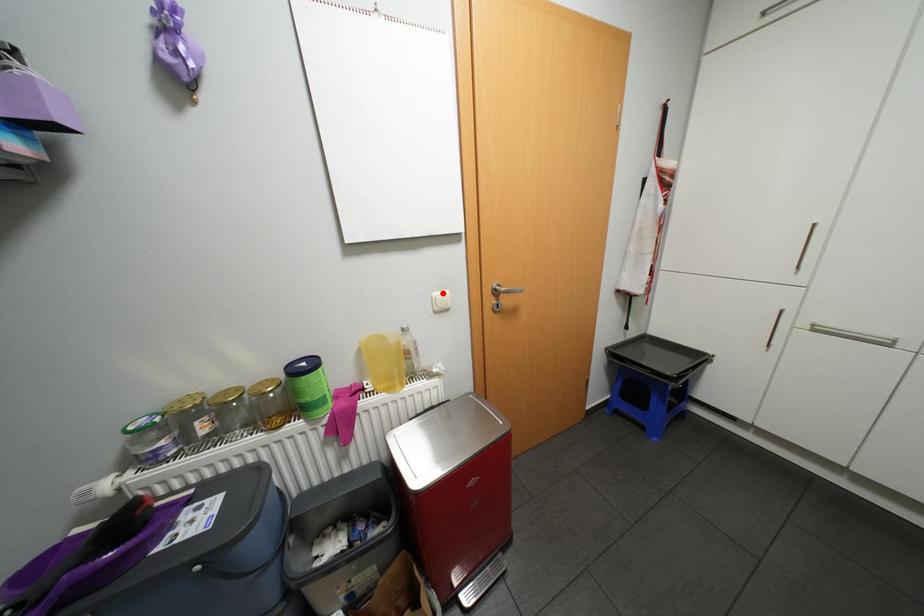
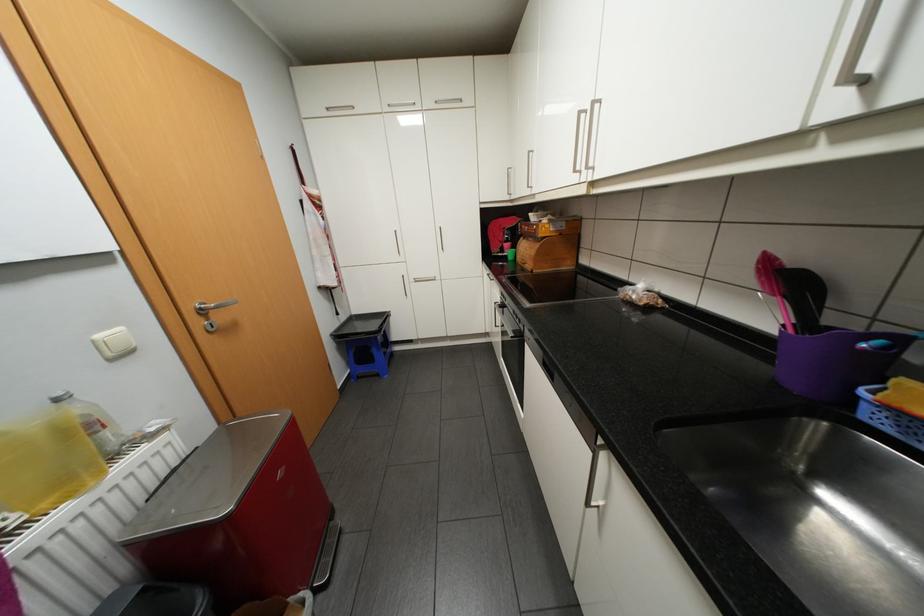
Find the pixel in the second image that matches the highlighted location in the first image.

(106, 334)